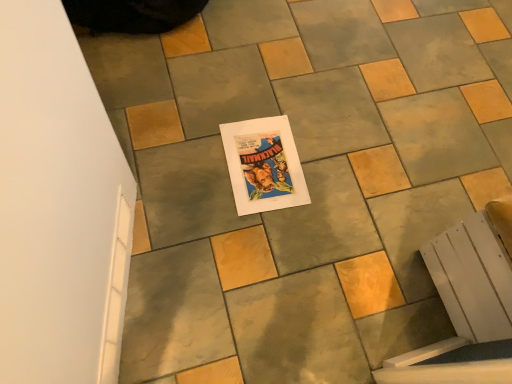
You are a GUI agent. You are given a task and a screenshot of the screen. Output one action in this format:
    pyautogui.click(x=<x>, y=<y>)
    Task: Click on the free space to the back side of vibrant paper comic book at center
    
    Given the screenshot: What is the action you would take?
    tap(276, 99)